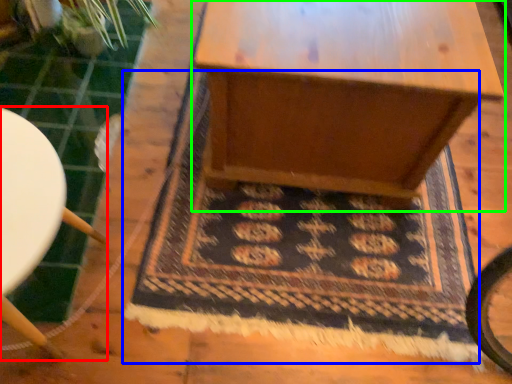
Question: Based on their relative distances, which object is farther from furniture (highlighted by a red box)? Choose from mat (highlighted by a blue box) and table (highlighted by a green box).

Choices:
 (A) mat
 (B) table

Answer: (B)